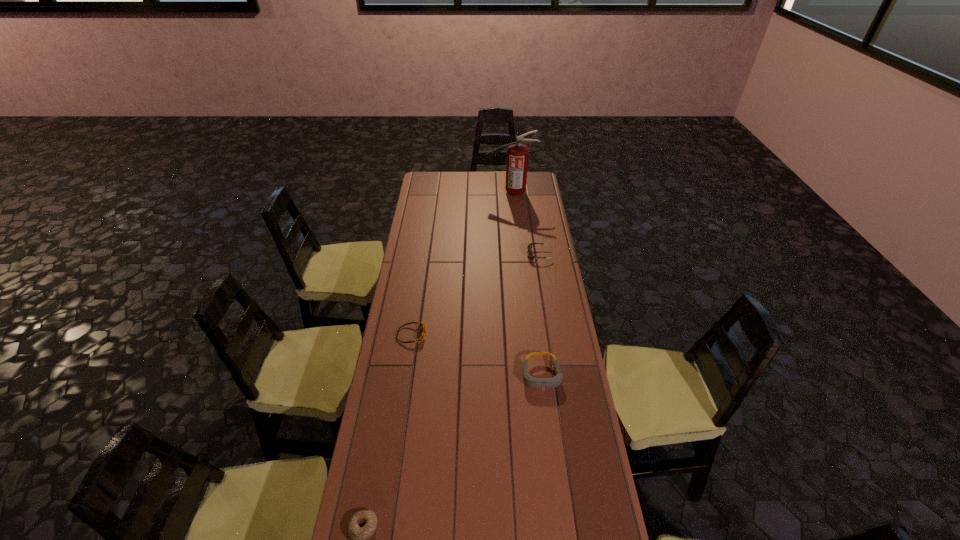
Find the location of a particular element. This screenshot has width=960, height=540. vacant space located on the front and back of the fourth farthest object is located at coordinates (548, 428).

I want to click on free region located 0.220m on the lenses of the second farthest object, so click(482, 255).

You are a GUI agent. You are given a task and a screenshot of the screen. Output one action in this format:
    pyautogui.click(x=<x>, y=<y>)
    Task: Click on the free space located 0.250m on the lenses of the second farthest object
    Image resolution: width=960 pixels, height=540 pixels.
    Given the screenshot: What is the action you would take?
    pyautogui.click(x=476, y=255)

You are a GUI agent. You are given a task and a screenshot of the screen. Output one action in this format:
    pyautogui.click(x=<x>, y=<y>)
    Task: Click on the vacant space located 0.140m on the lenses of the second farthest object
    This screenshot has height=540, width=960.
    Given the screenshot: What is the action you would take?
    pyautogui.click(x=498, y=255)

You are a GUI agent. You are given a task and a screenshot of the screen. Output one action in this format:
    pyautogui.click(x=<x>, y=<y>)
    Task: Click on the blank space located 0.340m with the lenses facing forward on the shortest goggles
    The image size is (960, 540).
    Given the screenshot: What is the action you would take?
    pyautogui.click(x=510, y=335)

Image resolution: width=960 pixels, height=540 pixels. What are the coordinates of `object at the far edge` in the screenshot? It's located at (517, 154).

This screenshot has height=540, width=960. I want to click on object at the left edge, so click(x=423, y=327).

Find the location of a particular element. The image size is (960, 540). fire extinguisher that is at the right edge is located at coordinates (517, 154).

I want to click on object located in the far right corner section of the desktop, so click(x=517, y=154).

This screenshot has width=960, height=540. In the image, there is a desktop. What are the coordinates of `vacant space at the far edge` in the screenshot? It's located at (462, 192).